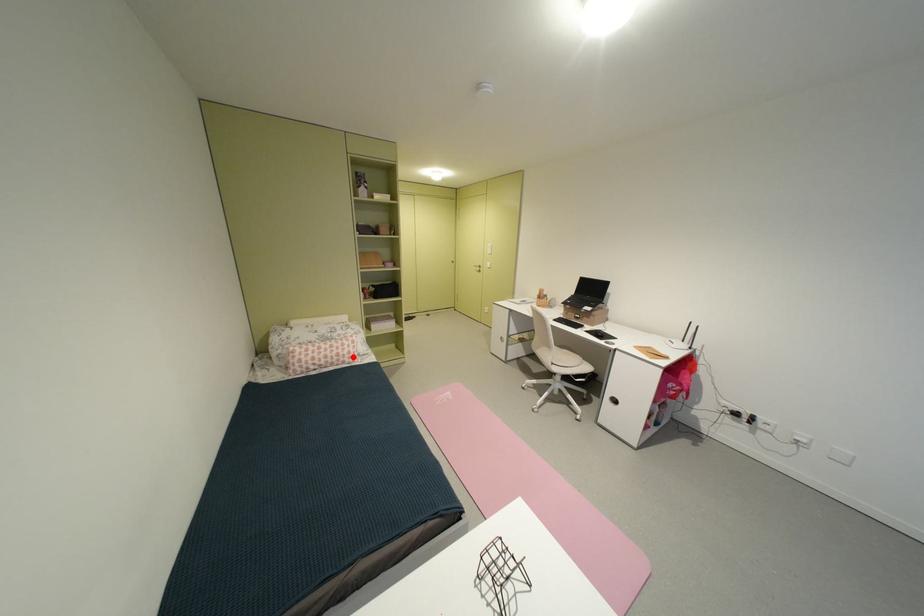
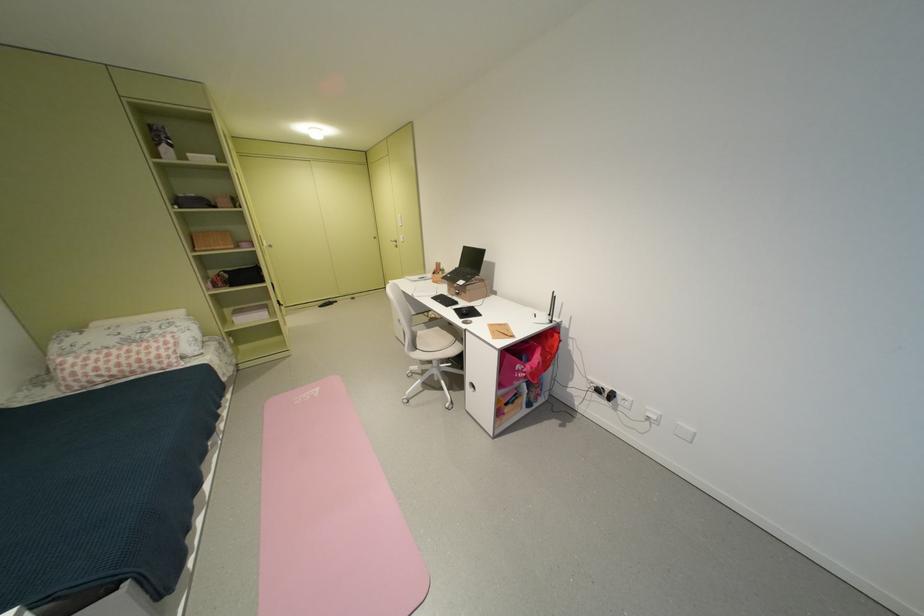
Question: I am providing you with two images of the same scene from different viewpoints. In image1, a red point is highlighted. Considering the same 3D point in image2, which of the following is correct?

Choices:
 (A) It is closer
 (B) It is farther

Answer: (B)